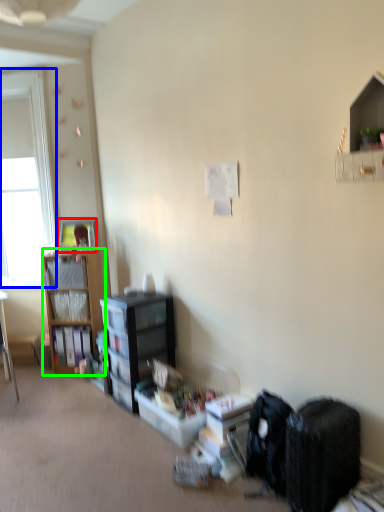
Question: Which object is positioned closest to picture frame (highlighted by a red box)? Select from window screen (highlighted by a blue box) and cabinetry (highlighted by a green box).

Choices:
 (A) window screen
 (B) cabinetry

Answer: (B)